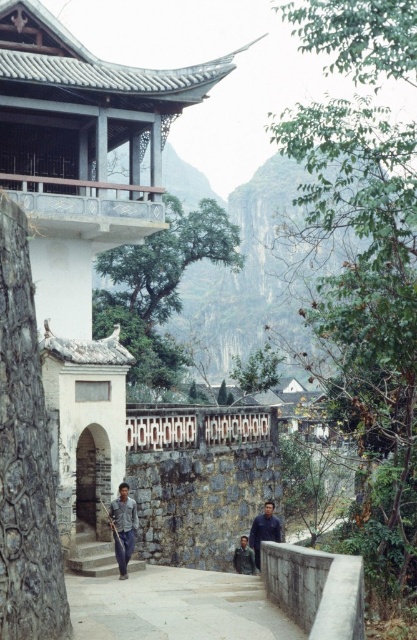
Between gray stone steps at center and stone stairs at lower left, which one has less height?

gray stone steps at center is shorter.

Which is more to the left, gray stone steps at center or stone stairs at lower left?

stone stairs at lower left is more to the left.

What are the coordinates of `gray stone steps at center` in the screenshot? It's located at (175, 605).

Which is in front, point (67, 513) or point (250, 532)?

Point (67, 513)

Which is more to the left, white stone temple at left or dark blue shirt at center?

From the viewer's perspective, white stone temple at left appears more on the left side.

Is point (30, 99) positioned in front of point (269, 534)?

No, (30, 99) is behind (269, 534).

Locate an element on the screen. This screenshot has height=640, width=417. white stone temple at left is located at coordinates (x=82, y=209).

Between point (112, 241) and point (248, 625), which one is positioned in front?

Point (248, 625) is more forward.

Does white stone temple at left appear on the right side of gray stone steps at center?

In fact, white stone temple at left is to the left of gray stone steps at center.

At what (x,y) coordinates should I click in order to perform the action: click on white stone temple at left. Please return your answer as a coordinate pair (x, y). The width and height of the screenshot is (417, 640). Looking at the image, I should click on pos(82,209).

Identify the location of white stone temple at left. (82, 209).